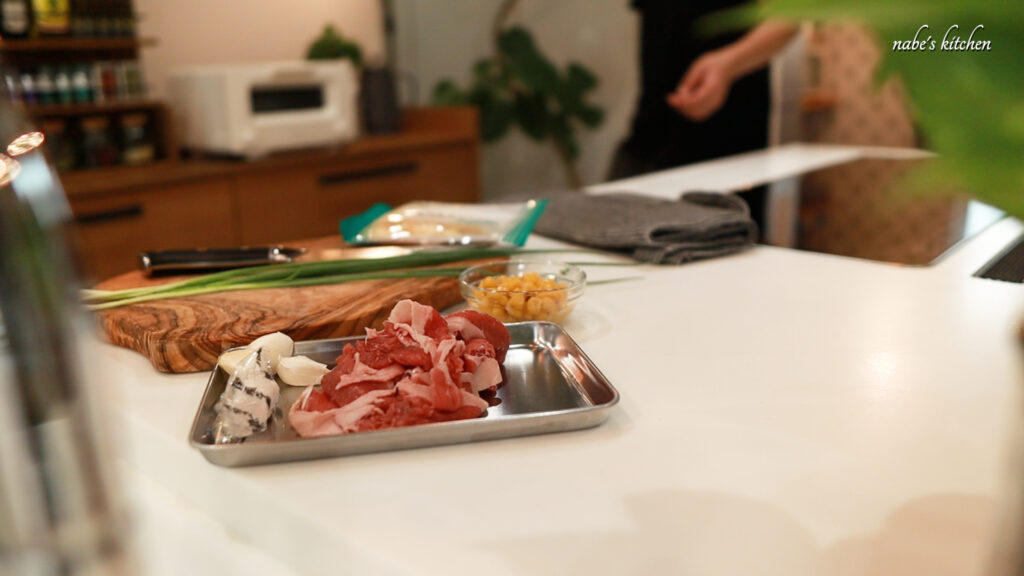
This screenshot has height=576, width=1024. I want to click on wood chopping board, so pos(266,310).